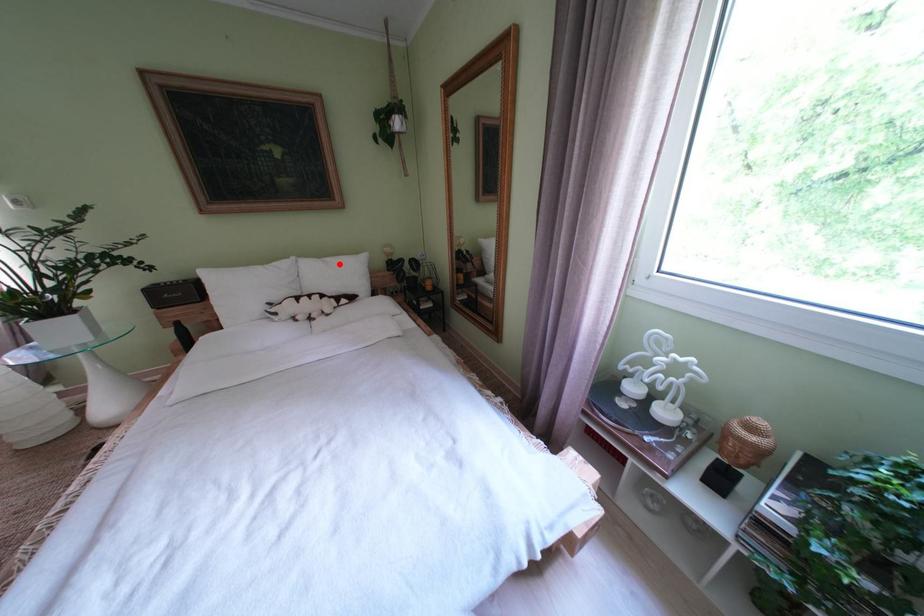
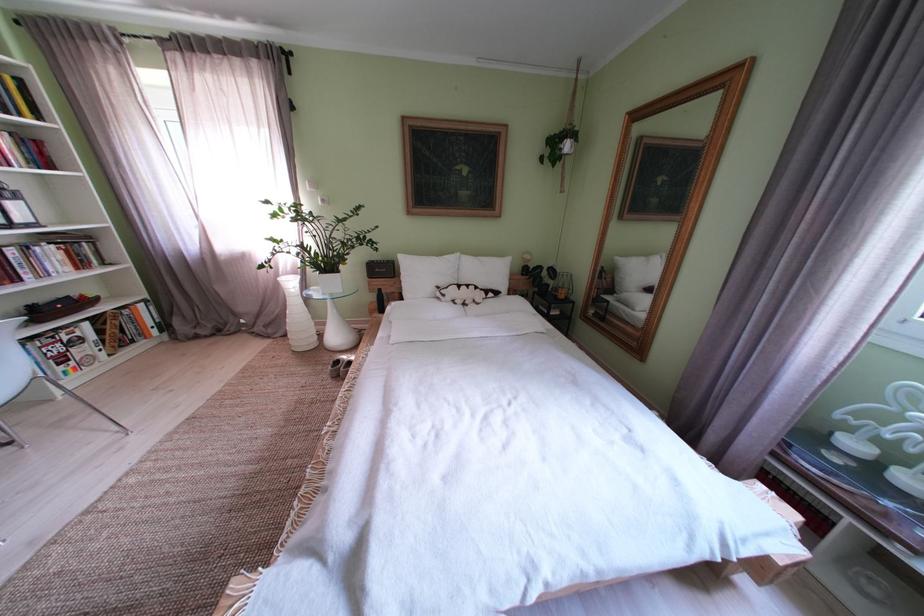
The point at the highlighted location is marked in the first image. Where is the corresponding point in the second image?

(492, 264)